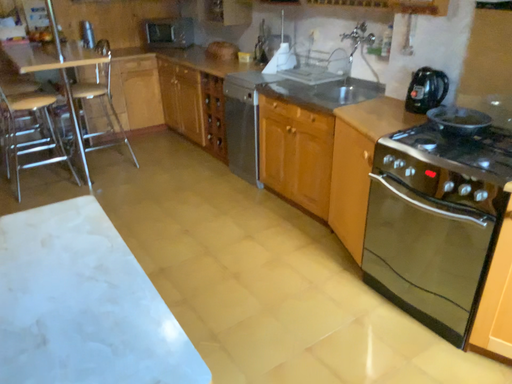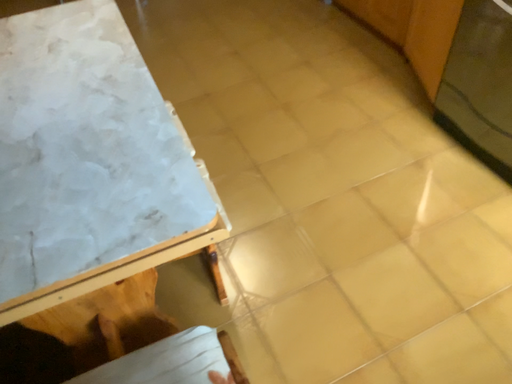
Question: Which way did the camera rotate in the video?

Choices:
 (A) rotated downward
 (B) rotated upward

Answer: (A)